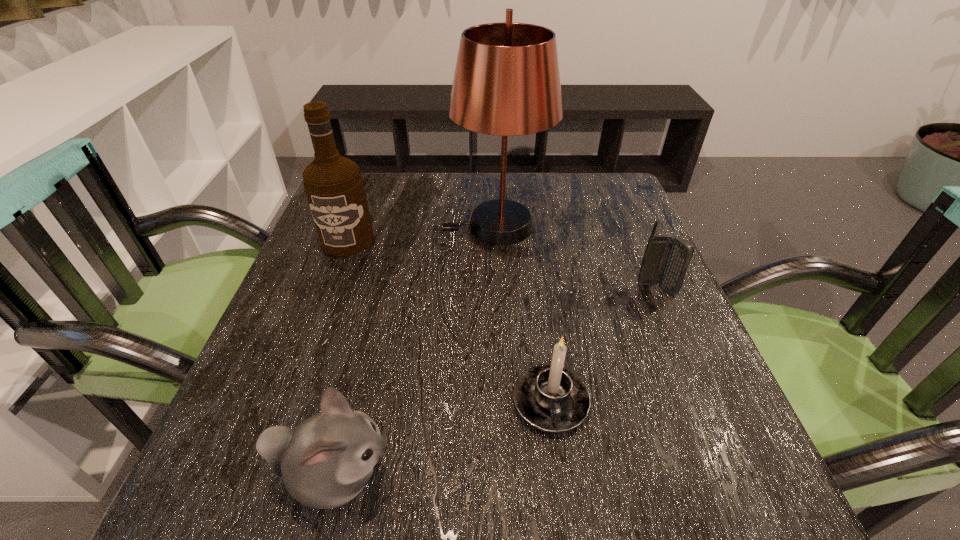
Where is `free region at the near edge of the desktop`? Image resolution: width=960 pixels, height=540 pixels. free region at the near edge of the desktop is located at coordinates (362, 501).

Image resolution: width=960 pixels, height=540 pixels. Identify the location of free region at the left edge of the desktop. (325, 330).

This screenshot has height=540, width=960. What are the coordinates of `vacant space at the right edge of the desktop` in the screenshot? It's located at (614, 250).

In the image, there is a desktop. Where is `vacant region at the near left corner`? vacant region at the near left corner is located at coordinates (276, 513).

Identify the location of free point at the far right corner. Image resolution: width=960 pixels, height=540 pixels. (598, 206).

This screenshot has width=960, height=540. What are the coordinates of `vacant area that lies between the hamster and the lampshade` in the screenshot? It's located at click(416, 350).

Image resolution: width=960 pixels, height=540 pixels. I want to click on vacant space that is in between the tallest object and the candle holder, so click(x=523, y=314).

You are a GUI agent. You are given a task and a screenshot of the screen. Output one action in this format:
    pyautogui.click(x=<x>, y=<y>)
    Task: Click on the free space between the second tallest object and the rightmost object
    This screenshot has width=960, height=540.
    Given the screenshot: What is the action you would take?
    pyautogui.click(x=502, y=265)

Image resolution: width=960 pixels, height=540 pixels. I want to click on free spot between the candle holder and the third nearest object, so 604,346.

You are a GUI agent. You are given a task and a screenshot of the screen. Output one action in this format:
    pyautogui.click(x=<x>, y=<y>)
    Task: Click on the free point between the hamster and the tallest object
    The height and width of the screenshot is (540, 960).
    Given the screenshot: What is the action you would take?
    pyautogui.click(x=416, y=350)